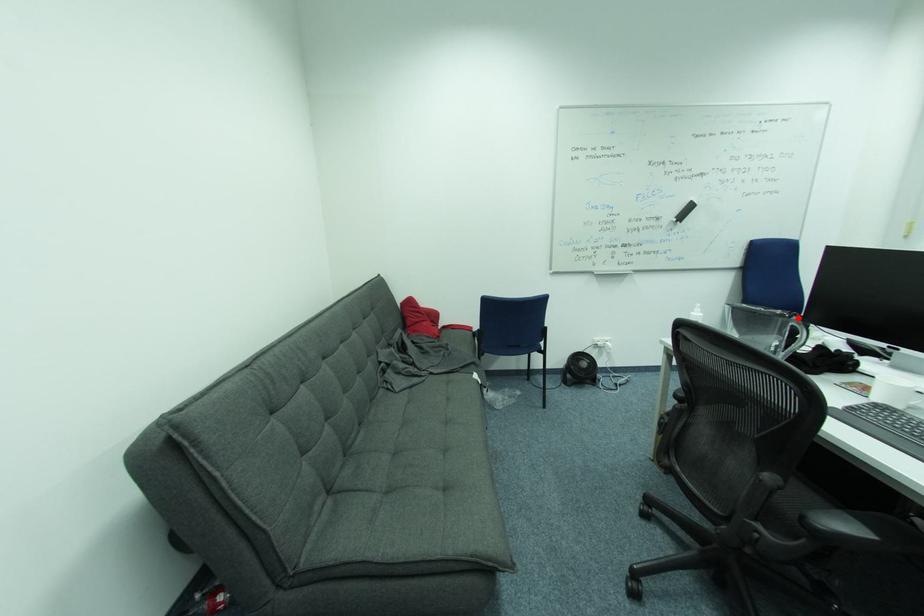
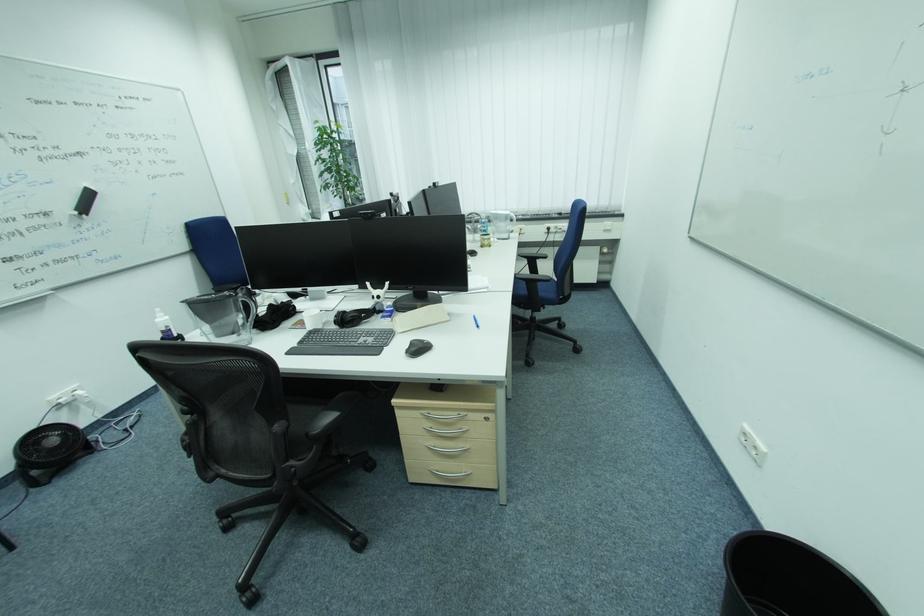
Find the pixel in the second image that matches the highlighted location in the first image.

(242, 294)